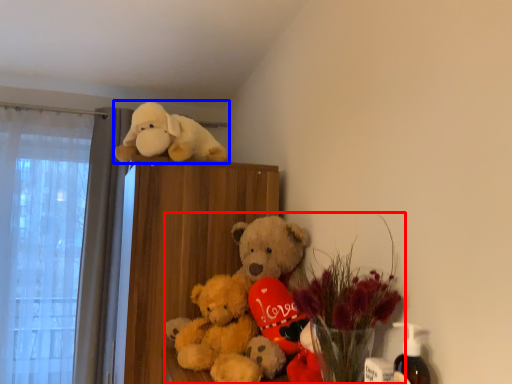
Question: Which object is further to the camera taking this photo, floral arrangement (highlighted by a red box) or toy (highlighted by a blue box)?

Choices:
 (A) floral arrangement
 (B) toy

Answer: (B)